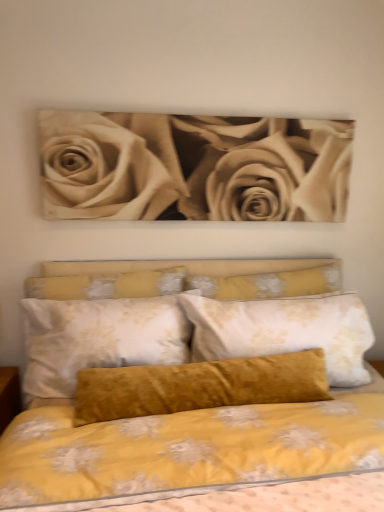
Question: From a real-world perspective, is velvet mustard pillow at center located beneath sepia-toned roses at upper center?

Choices:
 (A) no
 (B) yes

Answer: (B)

Question: Can you confirm if velvet mustard pillow at center is smaller than sepia-toned roses at upper center?

Choices:
 (A) no
 (B) yes

Answer: (A)

Question: Considering the relative positions of velvet mustard pillow at center and sepia-toned roses at upper center in the image provided, is velvet mustard pillow at center to the right of sepia-toned roses at upper center from the viewer's perspective?

Choices:
 (A) yes
 (B) no

Answer: (A)

Question: Is velvet mustard pillow at center oriented towards sepia-toned roses at upper center?

Choices:
 (A) no
 (B) yes

Answer: (A)

Question: Is the depth of velvet mustard pillow at center greater than that of sepia-toned roses at upper center?

Choices:
 (A) no
 (B) yes

Answer: (A)

Question: From a real-world perspective, relative to velvet yellow pillow at center, is velvet mustard pillow at center vertically above or below?

Choices:
 (A) above
 (B) below

Answer: (B)

Question: In terms of height, does velvet mustard pillow at center look taller or shorter compared to velvet yellow pillow at center?

Choices:
 (A) tall
 (B) short

Answer: (A)

Question: Does point (225, 444) appear closer or farther from the camera than point (326, 267)?

Choices:
 (A) closer
 (B) farther

Answer: (A)

Question: Considering the positions of velvet mustard pillow at center and velvet yellow pillow at center in the image, is velvet mustard pillow at center bigger or smaller than velvet yellow pillow at center?

Choices:
 (A) small
 (B) big

Answer: (B)

Question: Does point (311, 273) appear closer or farther from the camera than point (332, 183)?

Choices:
 (A) farther
 (B) closer

Answer: (B)

Question: In terms of width, does velvet yellow pillow at center look wider or thinner when compared to sepia-toned roses at upper center?

Choices:
 (A) thin
 (B) wide

Answer: (B)

Question: From the image's perspective, relative to sepia-toned roses at upper center, is velvet yellow pillow at center above or below?

Choices:
 (A) below
 (B) above

Answer: (A)

Question: Looking at the image, does velvet yellow pillow at center seem bigger or smaller compared to sepia-toned roses at upper center?

Choices:
 (A) big
 (B) small

Answer: (B)

Question: In terms of width, does velvet mustard pillow at center look wider or thinner when compared to sepia-toned roses at upper center?

Choices:
 (A) wide
 (B) thin

Answer: (A)

Question: Is point (286, 497) closer or farther from the camera than point (278, 119)?

Choices:
 (A) farther
 (B) closer

Answer: (B)